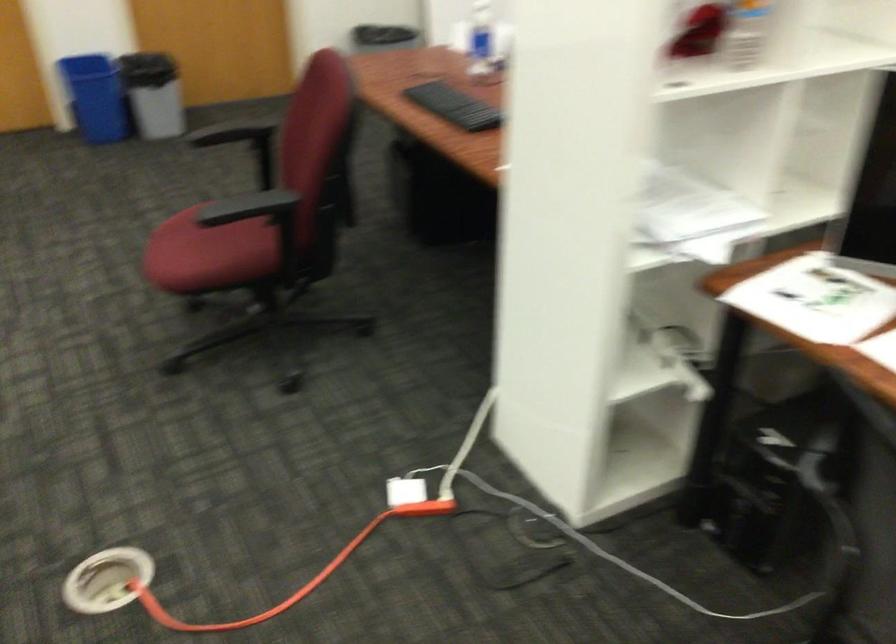
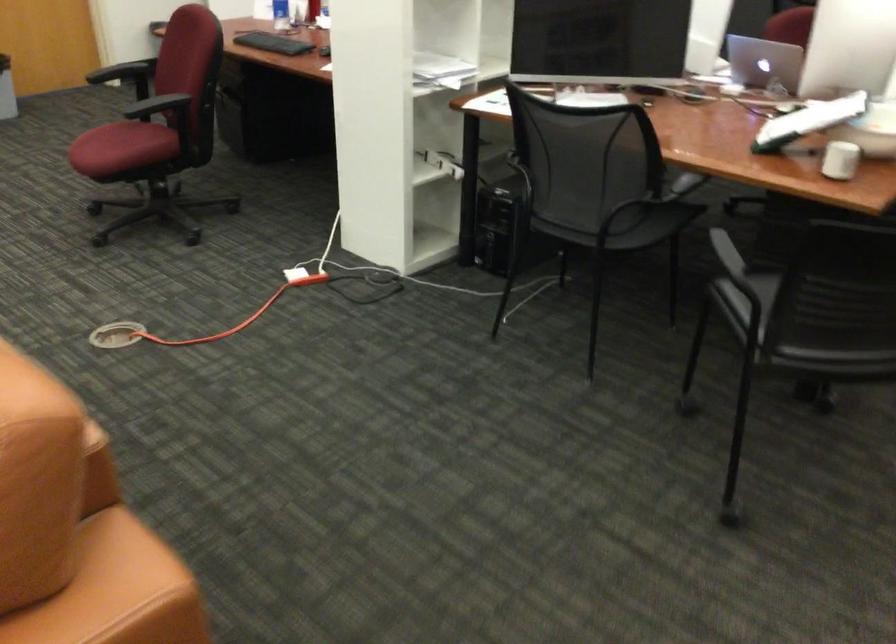
The point at (205, 267) is marked in the first image. Where is the corresponding point in the second image?

(122, 147)